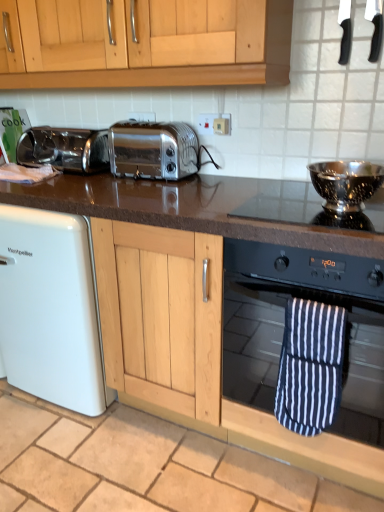
Question: Is black granite countertop at center not near satin chrome toaster at center, the 2th toaster in the left-to-right sequence?

Choices:
 (A) yes
 (B) no

Answer: (B)

Question: Does black granite countertop at center have a smaller size compared to satin chrome toaster at center, the 2th toaster in the left-to-right sequence?

Choices:
 (A) no
 (B) yes

Answer: (A)

Question: Would you say black granite countertop at center contains satin chrome toaster at center, the 2th toaster in the left-to-right sequence?

Choices:
 (A) no
 (B) yes

Answer: (A)

Question: From the image's perspective, would you say black granite countertop at center is positioned over satin chrome toaster at center, the 2th toaster in the left-to-right sequence?

Choices:
 (A) yes
 (B) no

Answer: (B)

Question: Can you confirm if black granite countertop at center is positioned to the right of satin chrome toaster at center, the first toaster positioned from the right?

Choices:
 (A) no
 (B) yes

Answer: (A)

Question: Is point (352, 199) positioned closer to the camera than point (226, 120)?

Choices:
 (A) farther
 (B) closer

Answer: (B)

Question: From a real-world perspective, relative to white plastic electric outlet at upper center, is polished stainless steel bowl at upper right, the 1th appliance from the bottom, vertically above or below?

Choices:
 (A) below
 (B) above

Answer: (A)

Question: Based on their sizes in the image, would you say polished stainless steel bowl at upper right, the 1th appliance from the bottom, is bigger or smaller than white plastic electric outlet at upper center?

Choices:
 (A) small
 (B) big

Answer: (B)

Question: Considering the relative positions of polished stainless steel bowl at upper right, the 3th appliance viewed from the top, and white plastic electric outlet at upper center in the image provided, is polished stainless steel bowl at upper right, the 3th appliance viewed from the top, to the left or to the right of white plastic electric outlet at upper center?

Choices:
 (A) right
 (B) left

Answer: (A)

Question: Looking at the image, does black plastic knife at upper right, positioned as the second appliance in top-to-bottom order, seem bigger or smaller compared to polished stainless steel bowl at upper right?

Choices:
 (A) big
 (B) small

Answer: (B)

Question: Is point (380, 20) closer or farther from the camera than point (274, 200)?

Choices:
 (A) closer
 (B) farther

Answer: (A)

Question: From a real-world perspective, relative to polished stainless steel bowl at upper right, is black plastic knife at upper right, the second appliance ordered from the bottom, vertically above or below?

Choices:
 (A) above
 (B) below

Answer: (A)

Question: Would you say black plastic knife at upper right, the second appliance ordered from the bottom, is inside or outside polished stainless steel bowl at upper right?

Choices:
 (A) inside
 (B) outside

Answer: (B)

Question: From the image's perspective, relative to black plastic knife at upper right, positioned as the second appliance in top-to-bottom order, is blue and white striped oven mitt at lower right above or below?

Choices:
 (A) below
 (B) above

Answer: (A)

Question: Relative to black plastic knife at upper right, the second appliance ordered from the bottom, is blue and white striped oven mitt at lower right in front or behind?

Choices:
 (A) behind
 (B) front

Answer: (B)